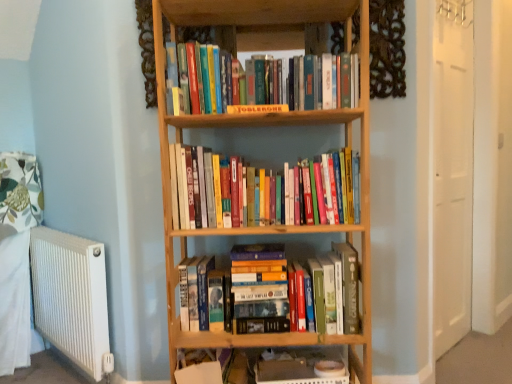
Question: Should I look upward or downward to see wooden shelf at lower center?

Choices:
 (A) up
 (B) down

Answer: (B)

Question: Considering the relative positions of matte yellow book at center and hardcover books at upper center, the 1th book when ordered from top to bottom, in the image provided, is matte yellow book at center behind hardcover books at upper center, the 1th book when ordered from top to bottom,?

Choices:
 (A) yes
 (B) no

Answer: (B)

Question: Does matte yellow book at center have a smaller size compared to hardcover books at upper center, the 1th book when ordered from top to bottom?

Choices:
 (A) no
 (B) yes

Answer: (B)

Question: Considering the relative sizes of matte yellow book at center and hardcover books at upper center, placed as the 3th book when sorted from bottom to top, in the image provided, is matte yellow book at center shorter than hardcover books at upper center, placed as the 3th book when sorted from bottom to top,?

Choices:
 (A) no
 (B) yes

Answer: (B)

Question: Can you confirm if matte yellow book at center is positioned to the right of hardcover books at upper center, the 1th book when ordered from top to bottom?

Choices:
 (A) yes
 (B) no

Answer: (B)

Question: Does matte yellow book at center appear on the left side of hardcover books at upper center, placed as the 3th book when sorted from bottom to top?

Choices:
 (A) no
 (B) yes

Answer: (B)

Question: Is matte yellow book at center facing towards hardcover books at upper center, the 1th book when ordered from top to bottom?

Choices:
 (A) yes
 (B) no

Answer: (B)

Question: From a real-world perspective, is wooden shelf at lower center physically below hardcover books at upper center, the 1th book when ordered from top to bottom?

Choices:
 (A) no
 (B) yes

Answer: (B)

Question: Can we say wooden shelf at lower center lies outside hardcover books at upper center, the 1th book when ordered from top to bottom?

Choices:
 (A) yes
 (B) no

Answer: (A)

Question: Does wooden shelf at lower center have a lesser height compared to hardcover books at upper center, placed as the 3th book when sorted from bottom to top?

Choices:
 (A) yes
 (B) no

Answer: (A)

Question: From the image's perspective, is wooden shelf at lower center below hardcover books at upper center, the 1th book when ordered from top to bottom?

Choices:
 (A) no
 (B) yes

Answer: (B)

Question: From a real-world perspective, is wooden shelf at lower center over hardcover books at upper center, placed as the 3th book when sorted from bottom to top?

Choices:
 (A) yes
 (B) no

Answer: (B)

Question: Is wooden shelf at lower center taller than hardcover books at upper center, placed as the 3th book when sorted from bottom to top?

Choices:
 (A) yes
 (B) no

Answer: (B)

Question: Is hardcover books at center, the second book in the top-to-bottom sequence, to the right of wooden shelf at lower center from the viewer's perspective?

Choices:
 (A) no
 (B) yes

Answer: (A)